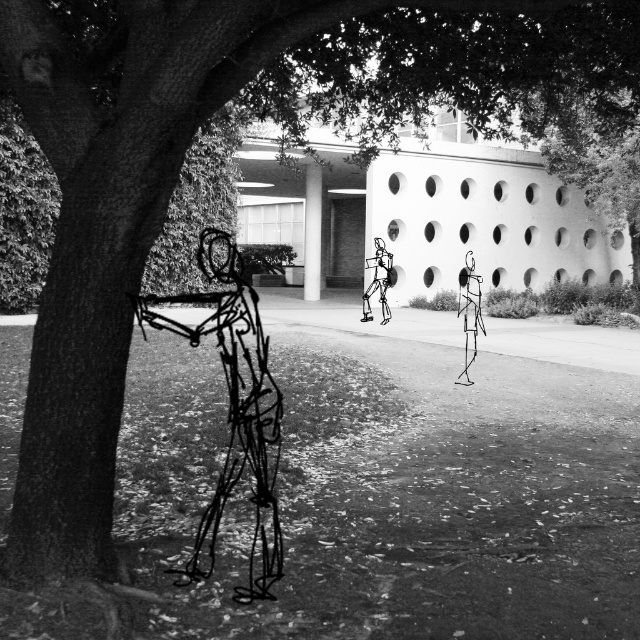
Does wireframe figure at left have a larger size compared to wireframe figure at center?

Yes.

Between wireframe figure at left and wireframe figure at center, which one appears on the right side from the viewer's perspective?

From the viewer's perspective, wireframe figure at center appears more on the right side.

The image size is (640, 640). In order to click on wireframe figure at left in this screenshot , I will do `click(232, 410)`.